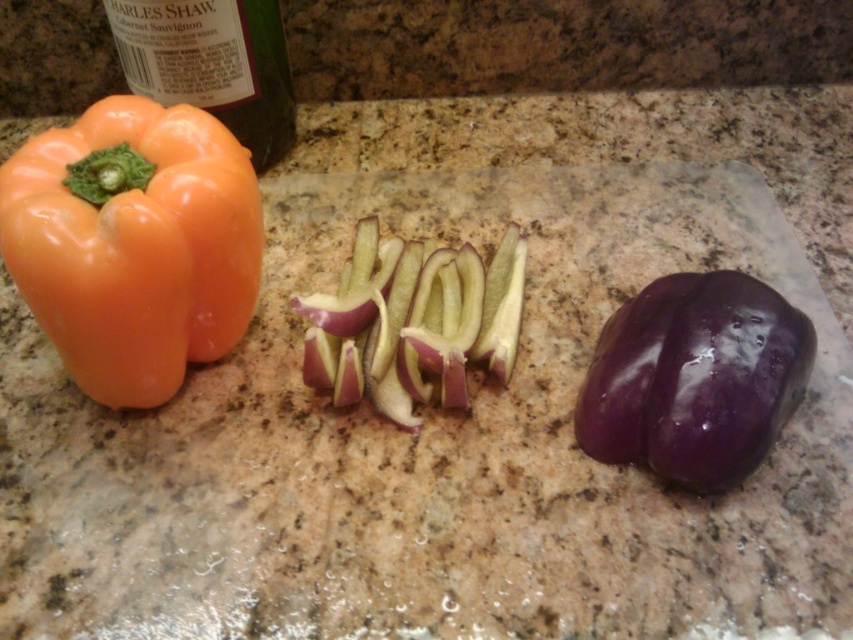
You are looking at the kitchen scene. There are two points marked in the image. One is at coordinate point (x=711, y=326) and the other is at point (x=253, y=10). Which point is closer to you?

Point (x=711, y=326) is closer to the camera than point (x=253, y=10).

You are preparing to place a small decorative plate on the kitchen countertop. The plate is exactly the same size as the green matte bottle at upper left. You want to place it next to the purple glossy sliced eggplant at center without overlapping. Is there enough space between them for the plate?

The purple glossy sliced eggplant at center is wider than the green matte bottle at upper left. Since the plate is the same size as the bottle, there should be enough space next to the eggplant as long as the distance between them accommodates the plate. However, the exact spacing isn